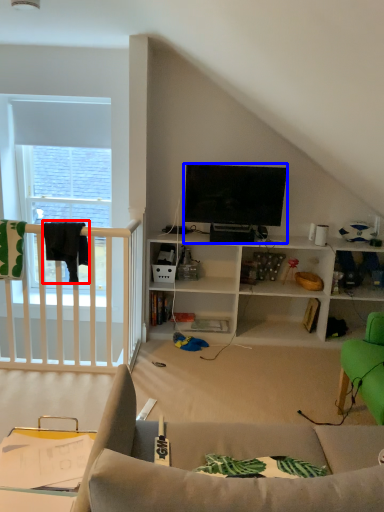
Question: Which of the following is the farthest to the observer, clothesline (highlighted by a red box) or television (highlighted by a blue box)?

Choices:
 (A) clothesline
 (B) television

Answer: (B)